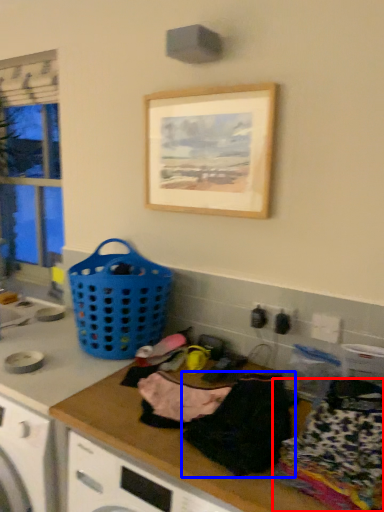
Question: Which point is further to the camera, clothing (highlighted by a red box) or clothing (highlighted by a blue box)?

Choices:
 (A) clothing
 (B) clothing

Answer: (B)